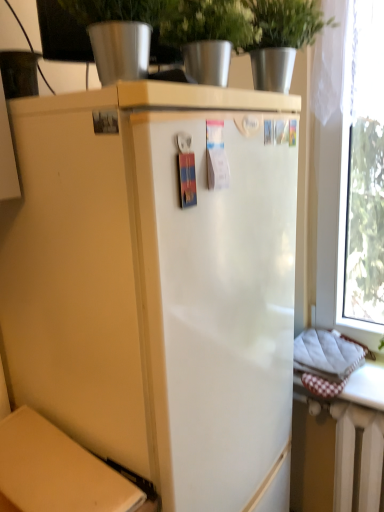
Consider the image. Measure the distance between transparent glass window at right and camera.

transparent glass window at right is 3.68 feet away from camera.

The image size is (384, 512). What do you see at coordinates (362, 170) in the screenshot?
I see `transparent glass window at right` at bounding box center [362, 170].

What is the approximate width of matte cardboard box at lower left?

matte cardboard box at lower left is 17.87 centimeters in width.

Locate an element on the screen. The height and width of the screenshot is (512, 384). transparent glass window at right is located at coordinates (362, 170).

Which point is more distant from viewer, (x=124, y=509) or (x=383, y=419)?

The point (x=383, y=419) is behind.

Find the location of a particular element. This screenshot has height=512, width=384. radiator lying on the right of matte cardboard box at lower left is located at coordinates (353, 456).

From the image's perspective, relative to white painted metal radiator at lower right, is matte cardboard box at lower left above or below?

Clearly, from the image's perspective, matte cardboard box at lower left is above white painted metal radiator at lower right.

From a real-world perspective, is transparent glass window at right beneath metallic silver pot at upper center?

Yes, from a real-world perspective, transparent glass window at right is under metallic silver pot at upper center.

Is transparent glass window at right not near metallic silver pot at upper center?

They are positioned close to each other.

Is transparent glass window at right taller than metallic silver pot at upper center?

Yes, transparent glass window at right is taller than metallic silver pot at upper center.

Between transparent glass window at right and metallic silver pot at upper center, which one has larger size?

With larger size is transparent glass window at right.

Between white painted metal radiator at lower right and matte cardboard box at lower left, which one has larger size?

Bigger between the two is white painted metal radiator at lower right.

Considering the positions of point (353, 437) and point (64, 461), is point (353, 437) closer or farther from the camera than point (64, 461)?

Point (353, 437) appears to be farther away from the viewer than point (64, 461).

From a real-world perspective, is white painted metal radiator at lower right under matte cardboard box at lower left?

Yes, from a real-world perspective, white painted metal radiator at lower right is beneath matte cardboard box at lower left.

Does matte cardboard box at lower left have a lesser width compared to metallic silver pot at upper center?

No, matte cardboard box at lower left is not thinner than metallic silver pot at upper center.

Is matte cardboard box at lower left in front of metallic silver pot at upper center?

Yes, it is in front of metallic silver pot at upper center.

Is metallic silver pot at upper center surrounded by matte cardboard box at lower left?

No, metallic silver pot at upper center is located outside of matte cardboard box at lower left.

Measure the distance from transparent glass window at right to white painted metal radiator at lower right.

transparent glass window at right is 20.91 inches away from white painted metal radiator at lower right.

Who is taller, transparent glass window at right or white painted metal radiator at lower right?

transparent glass window at right is taller.

Considering the relative positions of transparent glass window at right and white painted metal radiator at lower right in the image provided, is transparent glass window at right to the left or to the right of white painted metal radiator at lower right?

Clearly, transparent glass window at right is on the left of white painted metal radiator at lower right in the image.

This screenshot has width=384, height=512. I want to click on radiator below the transparent glass window at right (from the image's perspective), so click(353, 456).

From the image's perspective, is metallic silver pot at upper center under white painted metal radiator at lower right?

No, from the image's perspective, metallic silver pot at upper center is not beneath white painted metal radiator at lower right.

Is metallic silver pot at upper center facing away from white painted metal radiator at lower right?

No, metallic silver pot at upper center is not facing the opposite direction of white painted metal radiator at lower right.

Between metallic silver pot at upper center and white painted metal radiator at lower right, which one has more height?

With more height is white painted metal radiator at lower right.

Considering the relative positions of metallic silver pot at upper center and white painted metal radiator at lower right in the image provided, is metallic silver pot at upper center to the left of white painted metal radiator at lower right from the viewer's perspective?

Yes, metallic silver pot at upper center is to the left of white painted metal radiator at lower right.

Which point is more forward, (344, 462) or (355, 192)?

Point (344, 462)

From a real-world perspective, is white painted metal radiator at lower right on top of transparent glass window at right?

No, from a real-world perspective, white painted metal radiator at lower right is not over transparent glass window at right

How far apart are white painted metal radiator at lower right and transparent glass window at right?

white painted metal radiator at lower right is 53.12 centimeters away from transparent glass window at right.

The image size is (384, 512). I want to click on radiator to the right of matte cardboard box at lower left, so click(x=353, y=456).

Where is `window below the metallic silver pot at upper center (from the image's perspective)`? Image resolution: width=384 pixels, height=512 pixels. window below the metallic silver pot at upper center (from the image's perspective) is located at coordinates click(x=362, y=170).

Considering their positions, is transparent glass window at right positioned further to matte cardboard box at lower left than metallic silver pot at upper center?

transparent glass window at right is further to matte cardboard box at lower left.

Estimate the real-world distances between objects in this image. Which object is closer to white painted metal radiator at lower right, matte cardboard box at lower left or metallic silver pot at upper center?

Based on the image, matte cardboard box at lower left appears to be nearer to white painted metal radiator at lower right.

From the image, which object appears to be farther from transparent glass window at right, white painted metal radiator at lower right or matte cardboard box at lower left?

Based on the image, matte cardboard box at lower left appears to be further to transparent glass window at right.

Estimate the real-world distances between objects in this image. Which object is closer to transparent glass window at right, matte cardboard box at lower left or white painted metal radiator at lower right?

Among the two, white painted metal radiator at lower right is located nearer to transparent glass window at right.

When comparing their distances from transparent glass window at right, does metallic silver pot at upper center or matte cardboard box at lower left seem further?

matte cardboard box at lower left is further to transparent glass window at right.

Based on their spatial positions, is white painted metal radiator at lower right or matte cardboard box at lower left closer to metallic silver pot at upper center?

matte cardboard box at lower left is positioned closer to the anchor metallic silver pot at upper center.

Considering their positions, is metallic silver pot at upper center positioned further to white painted metal radiator at lower right than matte cardboard box at lower left?

Based on the image, metallic silver pot at upper center appears to be further to white painted metal radiator at lower right.

Considering their positions, is matte cardboard box at lower left positioned closer to transparent glass window at right than metallic silver pot at upper center?

metallic silver pot at upper center is closer to transparent glass window at right.

At what (x,y) coordinates should I click in order to perform the action: click on window between metallic silver pot at upper center and matte cardboard box at lower left vertically. Please return your answer as a coordinate pair (x, y). Looking at the image, I should click on (362, 170).

This screenshot has height=512, width=384. Identify the location of back between transparent glass window at right and white painted metal radiator at lower right from top to bottom. (56, 471).

You are a GUI agent. You are given a task and a screenshot of the screen. Output one action in this format:
    pyautogui.click(x=<x>, y=<y>)
    Task: Click on the window that lies between metallic silver pot at upper center and white painted metal radiator at lower right from top to bottom
    The image size is (384, 512).
    Given the screenshot: What is the action you would take?
    pyautogui.click(x=362, y=170)

The height and width of the screenshot is (512, 384). Identify the location of back between metallic silver pot at upper center and white painted metal radiator at lower right in the vertical direction. [56, 471].